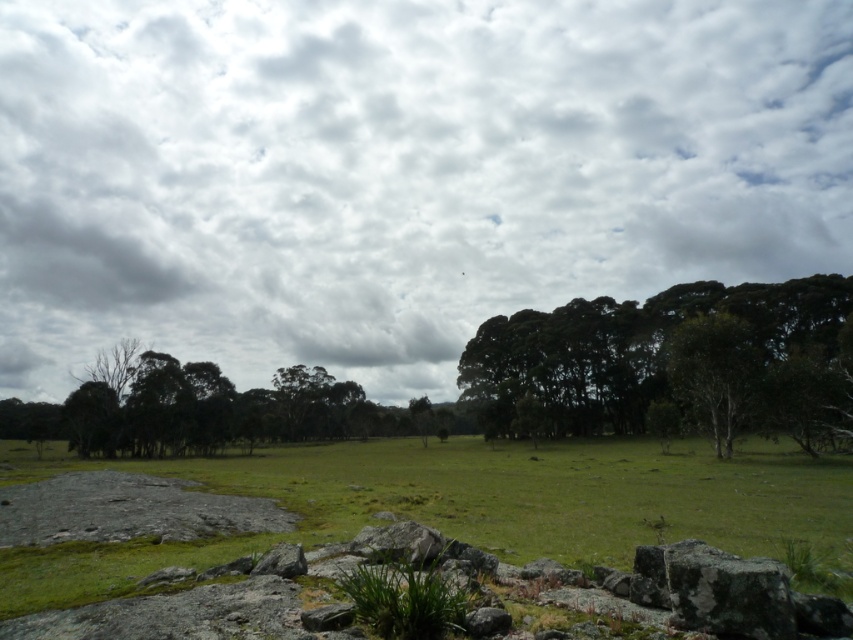
Question: Is green grassy pasture at center to the right of green leafy trees at center from the viewer's perspective?

Choices:
 (A) no
 (B) yes

Answer: (A)

Question: Which point is farther to the camera?

Choices:
 (A) green grassy pasture at center
 (B) green leafy trees at center
 (C) gray rough rock at center
 (D) cloudy sky at upper center

Answer: (D)

Question: Which is nearer to the green leafy tree at center?

Choices:
 (A) green grassy pasture at center
 (B) green leafy trees at center
 (C) cloudy sky at upper center

Answer: (B)

Question: Estimate the real-world distances between objects in this image. Which object is farther from the gray rough rock at lower left?

Choices:
 (A) green grassy pasture at center
 (B) green leafy tree at center
 (C) green leafy trees at center

Answer: (C)

Question: Is the position of cloudy sky at upper center more distant than that of green leafy tree at center?

Choices:
 (A) yes
 (B) no

Answer: (A)

Question: Does cloudy sky at upper center have a lesser width compared to green grassy pasture at center?

Choices:
 (A) no
 (B) yes

Answer: (A)